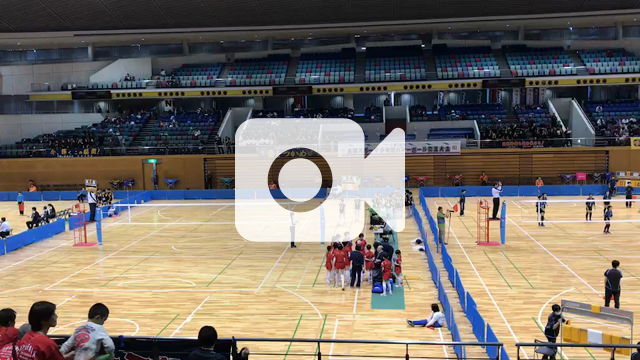
At what (x,y) coordinates should I click in order to perform the action: click on towels. Please return your answer as a coordinate pair (x, y). The image size is (640, 360). Looking at the image, I should click on 566,336, 579,336, 589,338, 603,338, 612,339, 623,347.